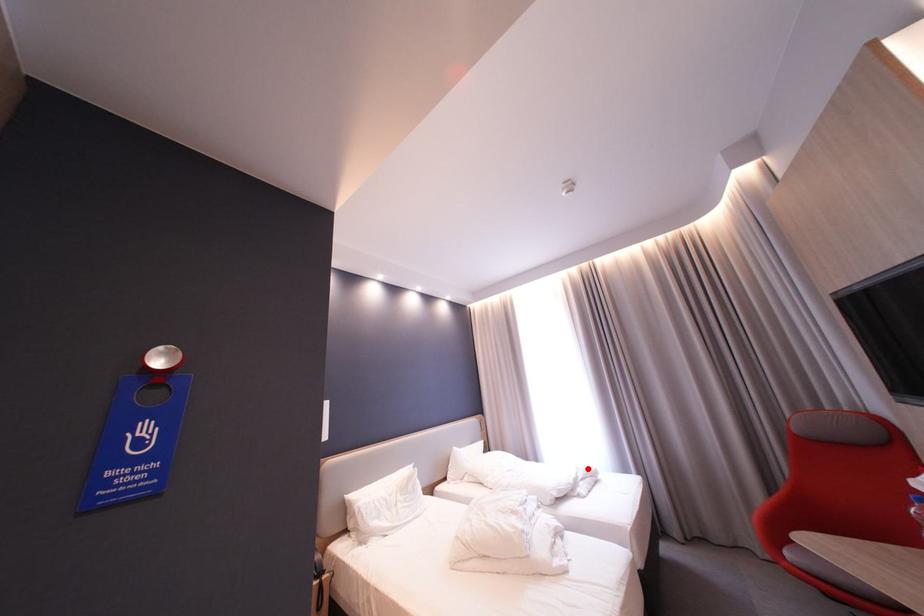
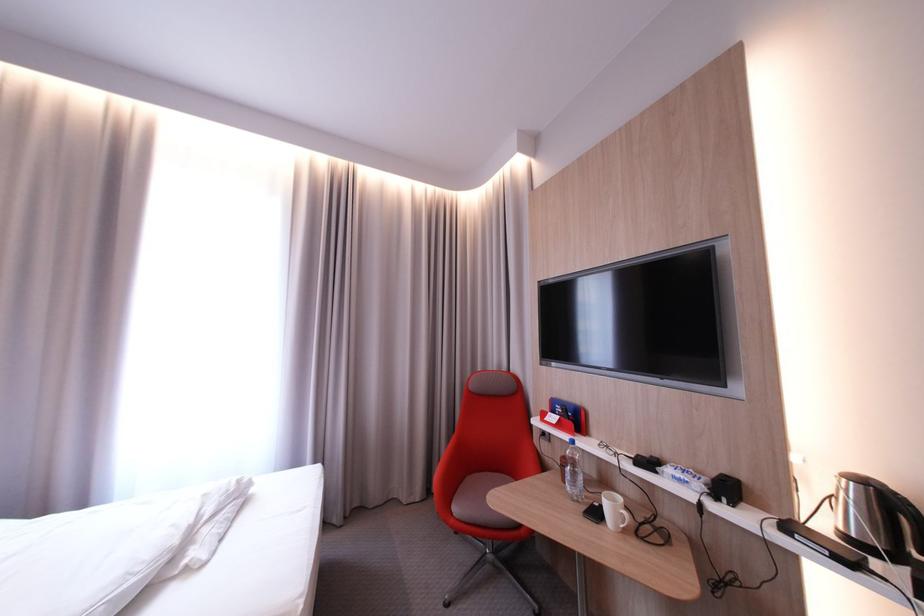
Where in the second image is the point corresponding to the highlighted location from the first image?

(215, 496)